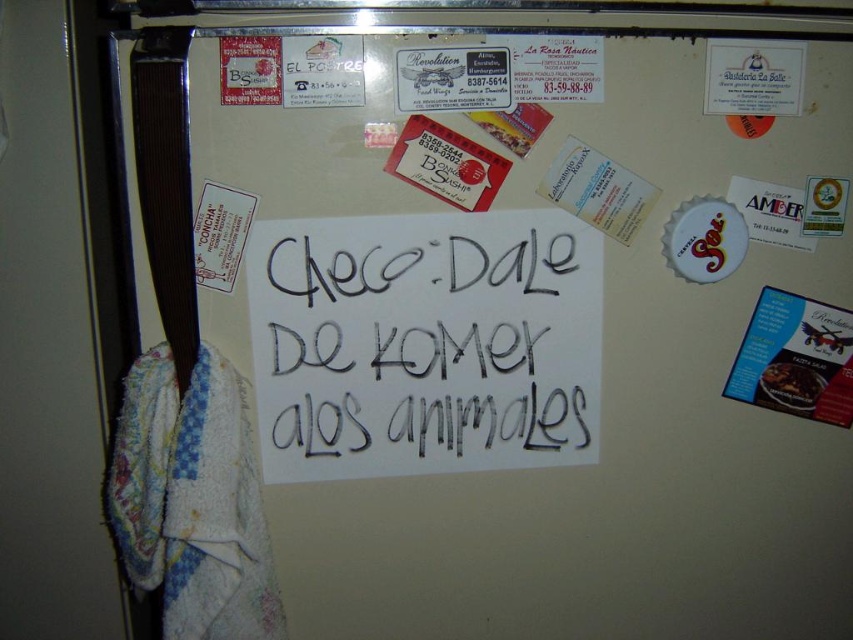
Is white fluffy towel at left closer to the viewer compared to black glossy food at upper right?

That is True.

Can you confirm if white fluffy towel at left is taller than black glossy food at upper right?

Correct, white fluffy towel at left is much taller as black glossy food at upper right.

Is point (171, 436) positioned before point (781, 381)?

Yes, point (171, 436) is closer to viewer.

Image resolution: width=853 pixels, height=640 pixels. Find the location of `white fluffy towel at left`. white fluffy towel at left is located at coordinates (192, 500).

Who is more distant from viewer, (303, 392) or (148, 579)?

The point (303, 392) is more distant.

The image size is (853, 640). I want to click on white paper at center, so [426, 342].

Which of these two, white paper at center or black glossy food at upper right, stands taller?

Standing taller between the two is white paper at center.

Does white paper at center have a lesser height compared to black glossy food at upper right?

No, white paper at center is not shorter than black glossy food at upper right.

Does point (329, 445) come farther from viewer compared to point (775, 403)?

No, (329, 445) is in front of (775, 403).

This screenshot has height=640, width=853. I want to click on white paper at center, so click(x=426, y=342).